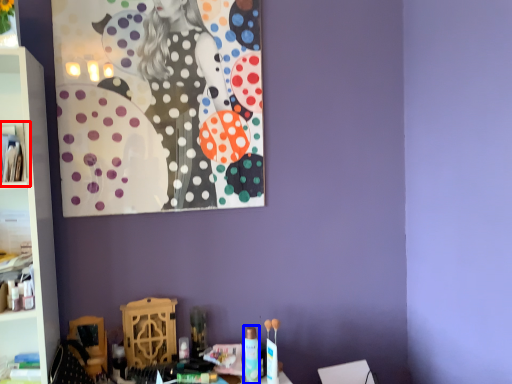
Question: Which of the following is the farthest to the observer, cabinet (highlighted by a red box) or toiletry (highlighted by a blue box)?

Choices:
 (A) cabinet
 (B) toiletry

Answer: (B)